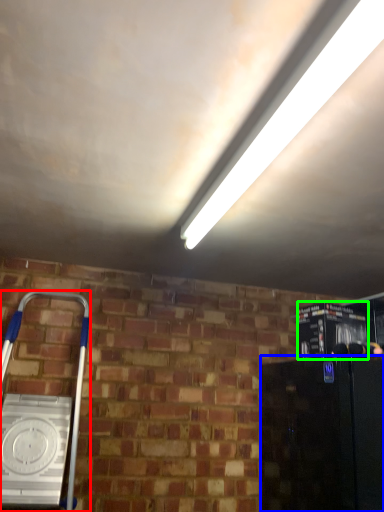
Question: Based on their relative distances, which object is nearer to home appliance (highlighted by a red box)? Choose from appliance (highlighted by a blue box) and appliance (highlighted by a green box).

Choices:
 (A) appliance
 (B) appliance

Answer: (A)